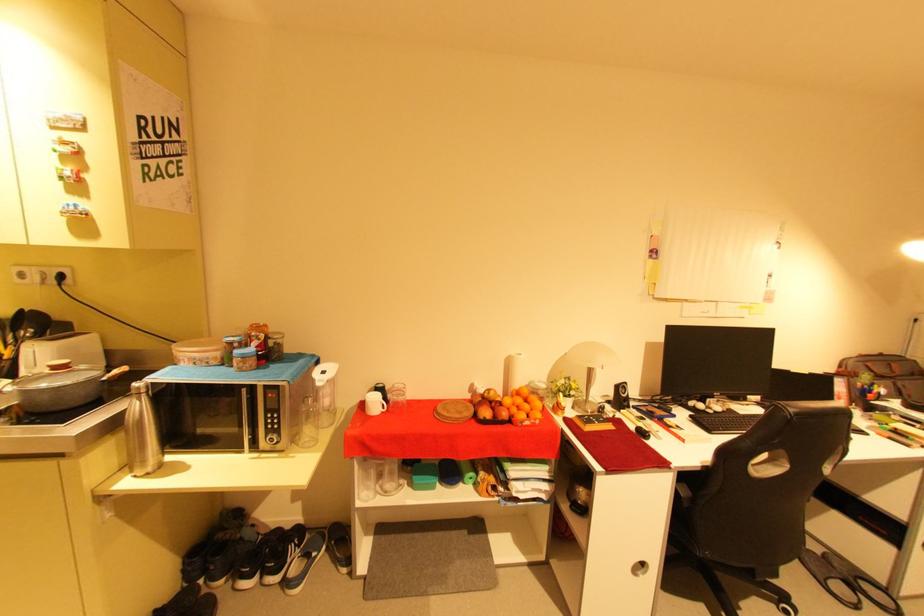
Where would you pull the microwave handle? Please return your answer as a coordinate pair (x, y).

(245, 421)